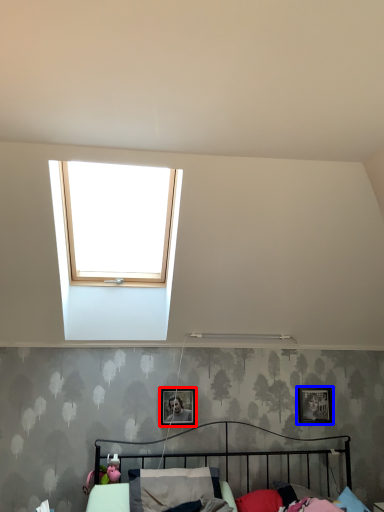
Question: Which object is further to the camera taking this photo, picture frame (highlighted by a red box) or picture frame (highlighted by a blue box)?

Choices:
 (A) picture frame
 (B) picture frame

Answer: (B)